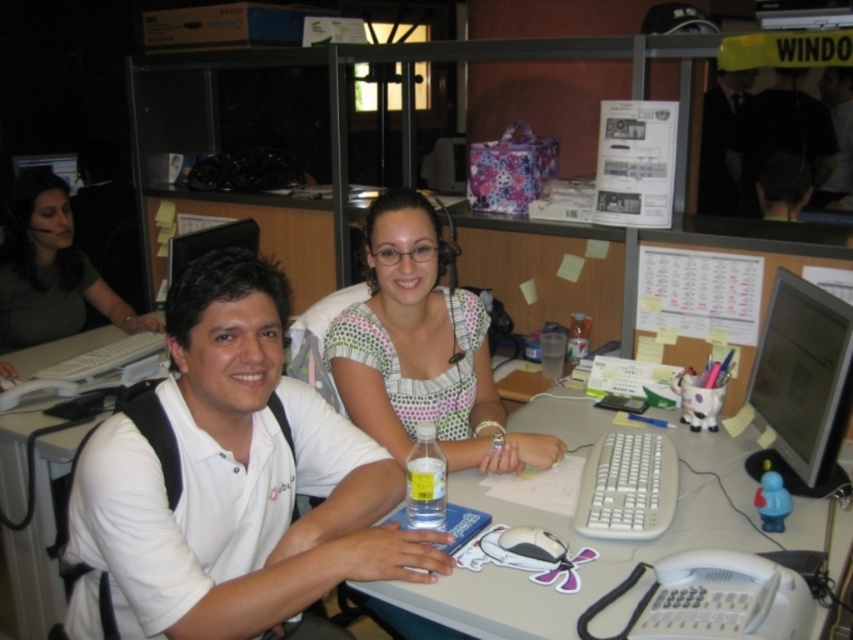
You are an office manager checking the layout of the workspace. You need to ensure that the matte green shirt at left and the white plastic table at center are arranged properly. According to the spatial arrangement, which object is wider?

The matte green shirt at left is wider than the white plastic table at center.

You are a technician who needs to reach the point at coordinate point (x=206, y=531) on the desk to fix a malfunctioning device. Your tool kit is 1.5 meters long. Can you safely extend your tool to reach that point without exceeding the desk length?

The distance of point (x=206, y=531) from camera is 1.22 meters, so yes, the technician can safely extend the tool kit to reach the point since the distance is within the tool kit length of 1.5 meters.

You are a new employee in the call center and need to locate two specific points on your desk. The first point is at coordinate point (254, 481) and the second is at coordinate point (837, 134). Which point is closer to you as you sit at your desk?

Point (254, 481) is closer to the viewer than point (837, 134).